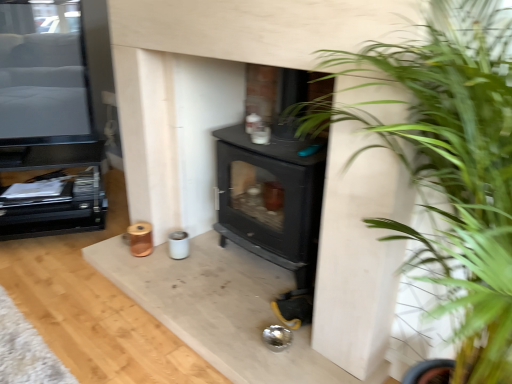
Question: Is black glossy tv at upper left, placed as the 1th entertainment center when sorted from top to bottom, situated inside green leafy plant at center right or outside?

Choices:
 (A) outside
 (B) inside

Answer: (A)

Question: Relative to green leafy plant at center right, is black glossy tv at upper left, positioned as the 2th entertainment center in bottom-to-top order, in front or behind?

Choices:
 (A) behind
 (B) front

Answer: (A)

Question: Which object is the closest to the black glossy tv at upper left, placed as the 1th entertainment center when sorted from top to bottom?

Choices:
 (A) green leafy plant at center right
 (B) black matte entertainment center at left, which is counted as the second entertainment center, starting from the top

Answer: (B)

Question: Estimate the real-world distances between objects in this image. Which object is farther from the green leafy plant at center right?

Choices:
 (A) black matte entertainment center at left, which is counted as the second entertainment center, starting from the top
 (B) black glossy tv at upper left, positioned as the 2th entertainment center in bottom-to-top order

Answer: (B)